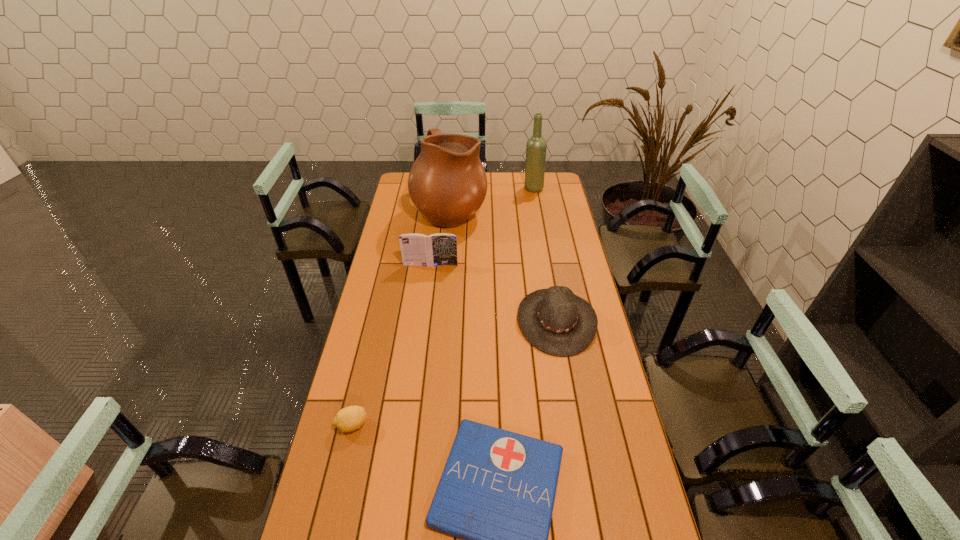
At what (x,y) coordinates should I click in order to perform the action: click on free spot between the cream pitcher and the third nearest object. Please return your answer as a coordinate pair (x, y). This screenshot has width=960, height=540. Looking at the image, I should click on (503, 265).

Locate an element on the screen. The image size is (960, 540). vacant space that's between the wine bottle and the third nearest object is located at coordinates (545, 255).

This screenshot has width=960, height=540. Find the location of `vacant space in between the cream pitcher and the wine bottle`. vacant space in between the cream pitcher and the wine bottle is located at coordinates (492, 199).

Locate an element on the screen. This screenshot has width=960, height=540. empty location between the third tallest object and the wine bottle is located at coordinates (482, 227).

Identify the location of free space between the fifth tallest object and the cream pitcher. The height and width of the screenshot is (540, 960). (401, 317).

Locate an element on the screen. This screenshot has height=540, width=960. vacant space that's between the wine bottle and the cream pitcher is located at coordinates (492, 199).

In order to click on free space between the wine bottle and the book in this screenshot , I will do `click(482, 227)`.

At what (x,y) coordinates should I click in order to perform the action: click on object that stands as the third closest to the lemon. Please return your answer as a coordinate pair (x, y). Image resolution: width=960 pixels, height=540 pixels. Looking at the image, I should click on (437, 249).

What are the coordinates of `object that stands as the second closest to the third tallest object` in the screenshot? It's located at (555, 321).

Identify the location of free space in the image that satisfies the following two spatial constraints: 1. on the front cover of the fourth nearest object; 2. at the stem end of the second shortest object. (410, 425).